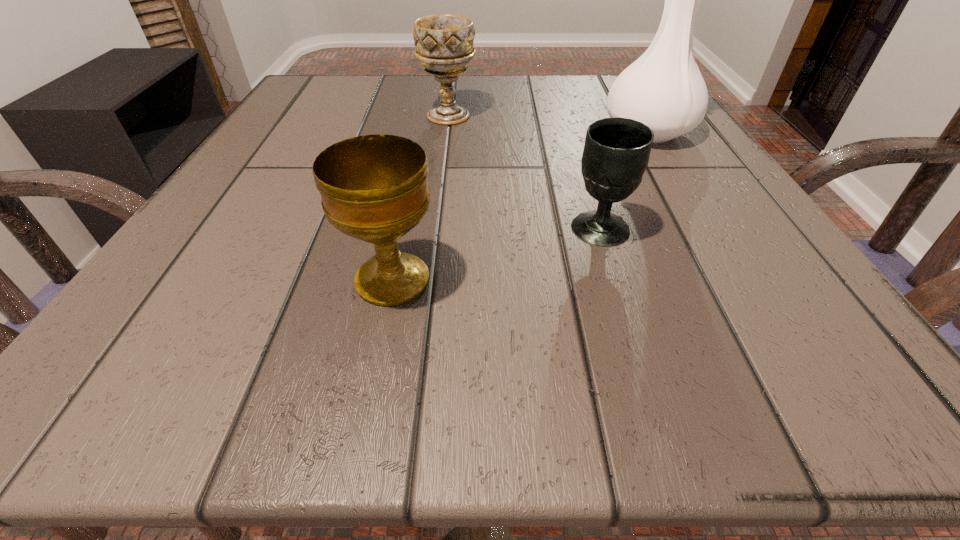
You are a GUI agent. You are given a task and a screenshot of the screen. Output one action in this format:
    pyautogui.click(x=<x>, y=<y>)
    Task: Click on the vase that is at the far edge
    Image resolution: width=960 pixels, height=540 pixels.
    Given the screenshot: What is the action you would take?
    pyautogui.click(x=663, y=89)

This screenshot has width=960, height=540. I want to click on chalice that is at the far edge, so click(x=444, y=43).

At what (x,y) coordinates should I click in order to perform the action: click on object located at the right edge. Please return your answer as a coordinate pair (x, y). Looking at the image, I should click on click(663, 89).

Where is `object present at the far right corner`? The height and width of the screenshot is (540, 960). object present at the far right corner is located at coordinates (663, 89).

The image size is (960, 540). In order to click on vacant space at the far edge of the desktop in this screenshot , I will do `click(375, 120)`.

Find the location of a particular element. This screenshot has width=960, height=540. vacant area at the left edge is located at coordinates (316, 197).

Identify the location of free region at the right edge of the desktop. The image size is (960, 540). (727, 208).

In the image, there is a desktop. Where is `free space at the far left corner`? This screenshot has height=540, width=960. free space at the far left corner is located at coordinates (359, 111).

In the image, there is a desktop. Where is `vacant space at the far right corner`? The width and height of the screenshot is (960, 540). vacant space at the far right corner is located at coordinates (595, 93).

This screenshot has width=960, height=540. What are the coordinates of `empty space between the farthest chalice and the third farthest object` in the screenshot? It's located at tap(524, 172).